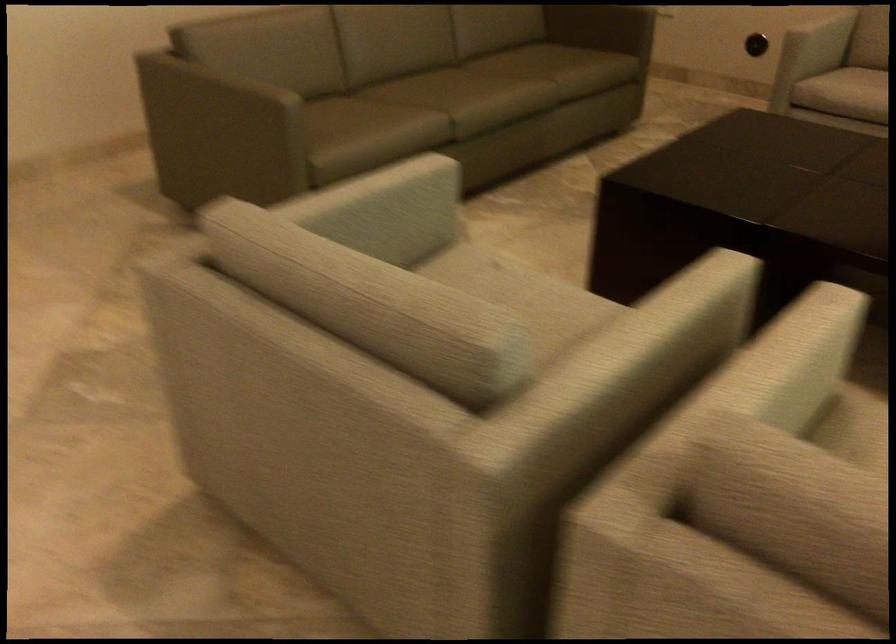
Image resolution: width=896 pixels, height=644 pixels. What do you see at coordinates (472, 91) in the screenshot?
I see `the sofa sitting surface` at bounding box center [472, 91].